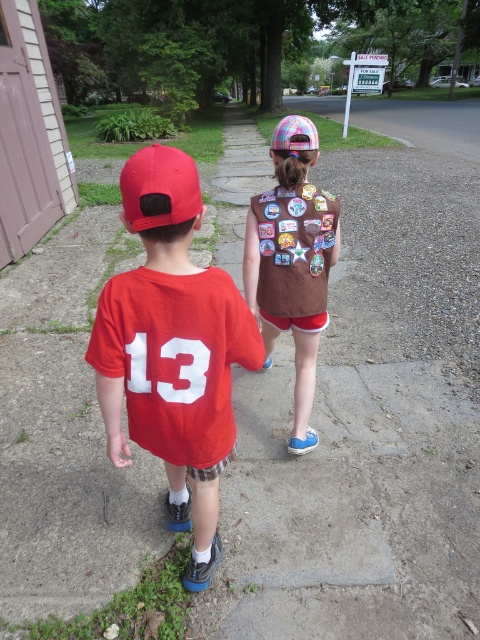
Which of these two, multicolored fabric baseball cap at upper center or smooth skin hand at lower left, stands taller?

With more height is multicolored fabric baseball cap at upper center.

Can you confirm if multicolored fabric baseball cap at upper center is positioned to the right of smooth skin hand at lower left?

Indeed, multicolored fabric baseball cap at upper center is positioned on the right side of smooth skin hand at lower left.

Describe the element at coordinates (294, 132) in the screenshot. I see `multicolored fabric baseball cap at upper center` at that location.

Identify the location of multicolored fabric baseball cap at upper center. The height and width of the screenshot is (640, 480). (294, 132).

Who is positioned more to the right, brown patchwork vest at center or matte red baseball cap at left?

Positioned to the right is brown patchwork vest at center.

Who is lower down, brown patchwork vest at center or matte red baseball cap at left?

brown patchwork vest at center is below.

Which is behind, point (244, 246) or point (175, 218)?

The point (244, 246) is behind.

Find the location of a particular element. The height and width of the screenshot is (640, 480). brown patchwork vest at center is located at coordinates (291, 260).

Which is in front, point (202, 308) or point (108, 429)?

Positioned in front is point (202, 308).

Does matte red cap at center have a greater width compared to smooth skin hand at lower left?

Yes.

Describe the element at coordinates (173, 348) in the screenshot. This screenshot has height=640, width=480. I see `matte red cap at center` at that location.

This screenshot has width=480, height=640. Identify the location of matte red cap at center. (173, 348).